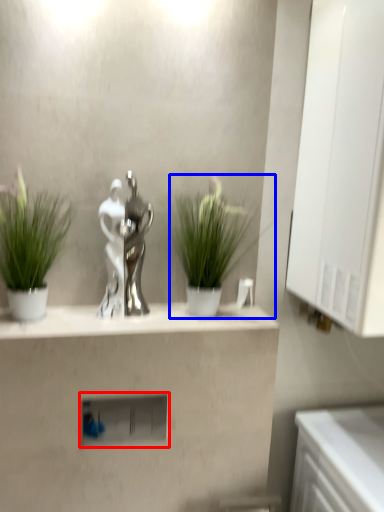
Question: Among these objects, which one is nearest to the camera, shelf (highlighted by a red box) or houseplant (highlighted by a blue box)?

Choices:
 (A) shelf
 (B) houseplant

Answer: (B)